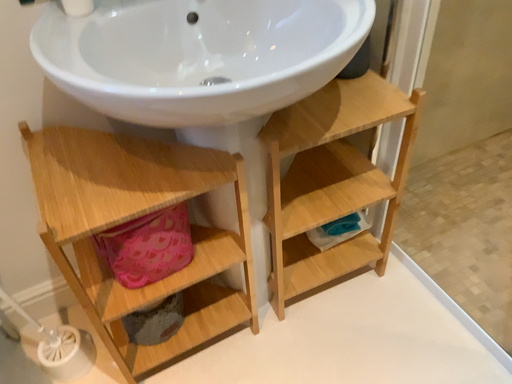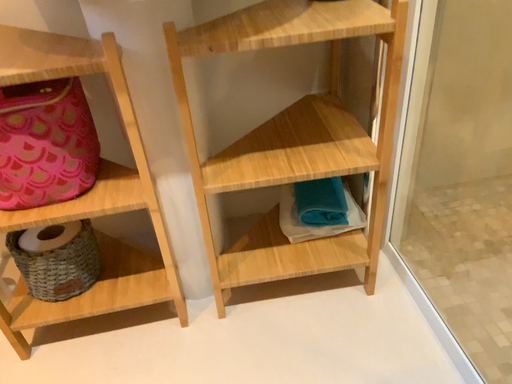
Question: Which way did the camera rotate in the video?

Choices:
 (A) rotated left
 (B) rotated right

Answer: (A)